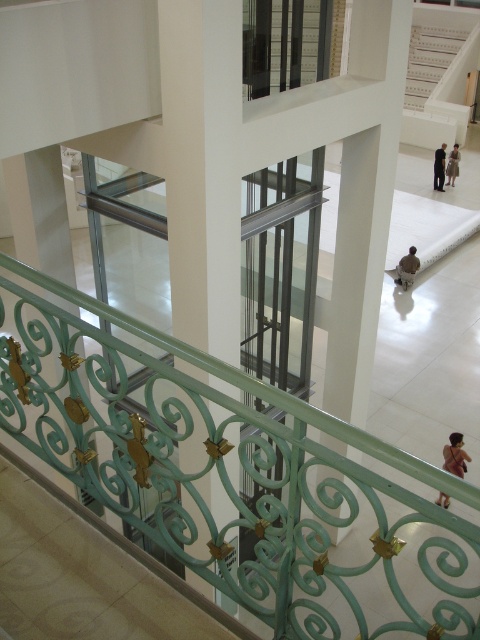
You are standing at the entrance of the building and see the point marked at coordinates (x=429, y=60). Based on the scene description, can you determine where this point is located?

The point marked at coordinates (x=429, y=60) is located on the white plastic stairs at upper center.

You are standing at the entrance of this modern space and want to reach the lower level where the seated person is. The white plastic stairs at upper center are your only option. Are they located to your left or right side?

The white plastic stairs at upper center are located at point 0.095 on the x and 0.894 on the y, so they are to your right side.

You are standing at the top of the white plastic stairs at upper center and want to greet the person wearing the light brown leather jacket at center. Which direction should you move to approach them?

The white plastic stairs at upper center is positioned on the right side of the light brown leather jacket at center, so you should move to your left to approach them.